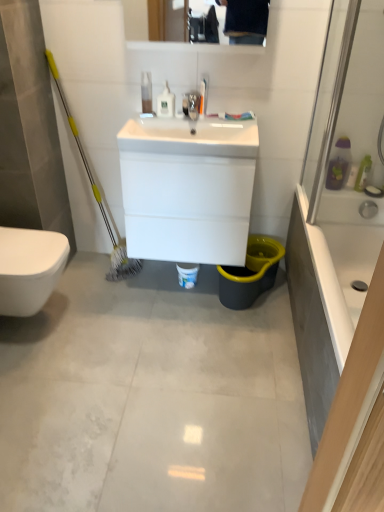
Question: Should I look upward or downward to see white glossy sink at center, the 2th sink from the top?

Choices:
 (A) down
 (B) up

Answer: (B)

Question: From the image's perspective, would you say white glossy bidet at lower left is positioned over white glossy sink at center, which is the first sink in bottom-to-top order?

Choices:
 (A) yes
 (B) no

Answer: (B)

Question: Is white glossy bidet at lower left facing away from white glossy sink at center, the 2th sink from the top?

Choices:
 (A) no
 (B) yes

Answer: (A)

Question: Considering the relative sizes of white glossy bidet at lower left and white glossy sink at center, which is the first sink in bottom-to-top order, in the image provided, is white glossy bidet at lower left thinner than white glossy sink at center, which is the first sink in bottom-to-top order,?

Choices:
 (A) yes
 (B) no

Answer: (B)

Question: From the image's perspective, would you say white glossy bidet at lower left is shown under white glossy sink at center, which is the first sink in bottom-to-top order?

Choices:
 (A) no
 (B) yes

Answer: (B)

Question: From a real-world perspective, is white glossy bidet at lower left located higher than white glossy sink at center, the 2th sink from the top?

Choices:
 (A) yes
 (B) no

Answer: (B)

Question: Is white glossy bidet at lower left closer to the viewer compared to white glossy sink at center, which is the first sink in bottom-to-top order?

Choices:
 (A) no
 (B) yes

Answer: (B)

Question: Does white glossy bottle at upper center, the second toiletry positioned from the right, have a greater width compared to white glossy bathtub at right?

Choices:
 (A) yes
 (B) no

Answer: (B)

Question: Can you confirm if white glossy bottle at upper center, which is the 2th toiletry from top to bottom, is positioned to the right of white glossy bathtub at right?

Choices:
 (A) yes
 (B) no

Answer: (B)

Question: Are white glossy bottle at upper center, the 2th toiletry in the left-to-right sequence, and white glossy bathtub at right making contact?

Choices:
 (A) yes
 (B) no

Answer: (B)

Question: Is white glossy bathtub at right located within white glossy bottle at upper center, marked as the second toiletry in a bottom-to-top arrangement?

Choices:
 (A) no
 (B) yes

Answer: (A)

Question: Considering the relative sizes of white glossy bottle at upper center, marked as the second toiletry in a bottom-to-top arrangement, and white glossy bathtub at right in the image provided, is white glossy bottle at upper center, marked as the second toiletry in a bottom-to-top arrangement, bigger than white glossy bathtub at right?

Choices:
 (A) no
 (B) yes

Answer: (A)

Question: From a real-world perspective, does white glossy bottle at upper center, marked as the second toiletry in a bottom-to-top arrangement, stand above white glossy bathtub at right?

Choices:
 (A) no
 (B) yes

Answer: (B)

Question: Does gray tile floor at center appear on the left side of white glossy sink at center, which is the first sink from top to bottom?

Choices:
 (A) no
 (B) yes

Answer: (B)